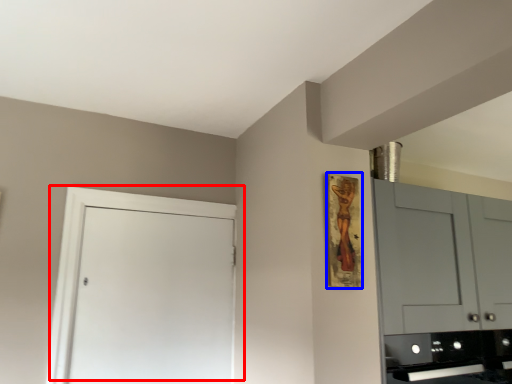
Question: Which object appears farthest to the camera in this image, door (highlighted by a red box) or picture frame (highlighted by a blue box)?

Choices:
 (A) door
 (B) picture frame

Answer: (A)